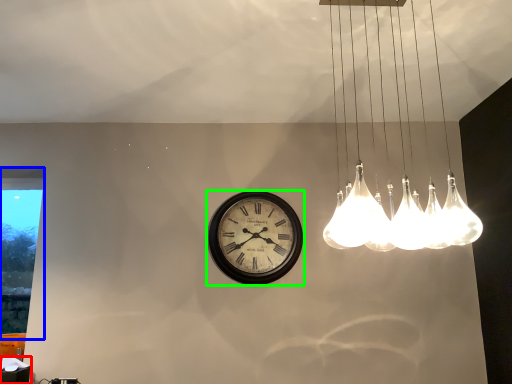
Question: Which is nearer to the table (highlighted by a red box)? window (highlighted by a blue box) or wall clock (highlighted by a green box).

Choices:
 (A) window
 (B) wall clock

Answer: (B)